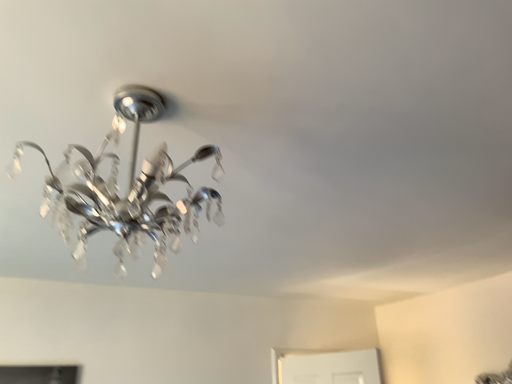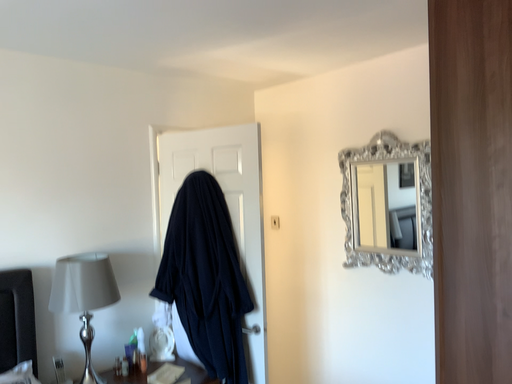
Question: How did the camera likely rotate when shooting the video?

Choices:
 (A) rotated left
 (B) rotated right

Answer: (B)